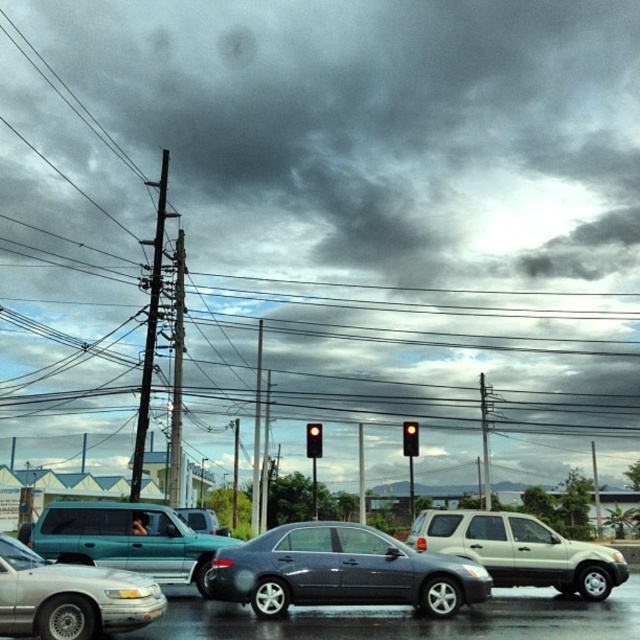
Question: Can you confirm if dark gray cloud at upper center is positioned to the left of metallic silver sedan at lower left?

Choices:
 (A) yes
 (B) no

Answer: (B)

Question: Which of the following is the closest to the observer?

Choices:
 (A) [432, 561]
 (B) [307, 444]
 (C) [528, 356]
 (D) [198, 508]

Answer: (A)

Question: Can you confirm if shiny dark gray sedan at center is thinner than metallic gray utility pole at left?

Choices:
 (A) no
 (B) yes

Answer: (B)

Question: Which of the following is the closest to the observer?

Choices:
 (A) (285, 572)
 (B) (556, 584)
 (C) (177, 509)

Answer: (A)

Question: Is shiny dark gray sedan at center thinner than teal matte van at center?

Choices:
 (A) no
 (B) yes

Answer: (B)

Question: Considering the real-world distances, which object is farthest from the dark gray cloud at upper center?

Choices:
 (A) teal matte suv at center
 (B) metallic gray utility pole at left
 (C) beige matte suv at center
 (D) yellow glass traffic light at center

Answer: (A)